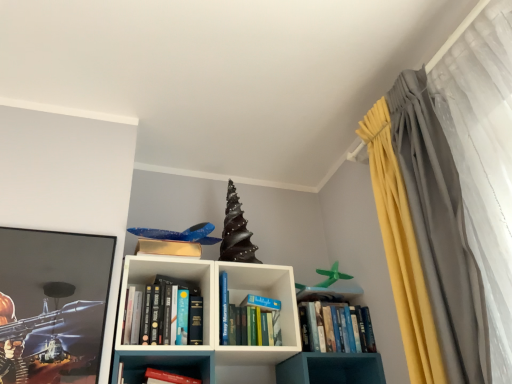
Question: Can you confirm if blue hardcover book at center, acting as the first book starting from the right, is bigger than hardcover book at center, which is counted as the second book, starting from the right?

Choices:
 (A) no
 (B) yes

Answer: (B)

Question: From the image's perspective, is blue hardcover book at center, acting as the first book starting from the right, under hardcover book at center, which appears as the second book when viewed from the left?

Choices:
 (A) no
 (B) yes

Answer: (A)

Question: Is blue hardcover book at center, placed as the 3th book when sorted from left to right, wider than hardcover book at center, which is counted as the second book, starting from the right?

Choices:
 (A) no
 (B) yes

Answer: (B)

Question: From the image's perspective, is blue hardcover book at center, placed as the 3th book when sorted from left to right, above hardcover book at center, which appears as the second book when viewed from the left?

Choices:
 (A) yes
 (B) no

Answer: (A)

Question: Is blue hardcover book at center, acting as the first book starting from the right, oriented away from hardcover book at center, which is counted as the second book, starting from the right?

Choices:
 (A) yes
 (B) no

Answer: (B)

Question: From a real-world perspective, is blue hardcover book at center, acting as the first book starting from the right, positioned under hardcover book at center, which is counted as the second book, starting from the right, based on gravity?

Choices:
 (A) yes
 (B) no

Answer: (B)

Question: Does blue hardcover book at center, acting as the first book starting from the right, have a smaller size compared to white matte bookshelf at center?

Choices:
 (A) no
 (B) yes

Answer: (B)

Question: Does blue hardcover book at center, acting as the first book starting from the right, have a lesser height compared to white matte bookshelf at center?

Choices:
 (A) no
 (B) yes

Answer: (B)

Question: From the image's perspective, is blue hardcover book at center, placed as the 3th book when sorted from left to right, located above white matte bookshelf at center?

Choices:
 (A) yes
 (B) no

Answer: (B)

Question: Would you say white matte bookshelf at center is part of blue hardcover book at center, placed as the 3th book when sorted from left to right,'s contents?

Choices:
 (A) yes
 (B) no

Answer: (B)

Question: Can you confirm if blue hardcover book at center, acting as the first book starting from the right, is taller than white matte bookshelf at center?

Choices:
 (A) no
 (B) yes

Answer: (A)

Question: Is blue hardcover book at center, placed as the 3th book when sorted from left to right, at the right side of white matte bookshelf at center?

Choices:
 (A) no
 (B) yes

Answer: (B)

Question: Could blue hardcover book at center, acting as the first book starting from the right, be considered to be inside hardcover books at center, which ranks as the third book in right-to-left order?

Choices:
 (A) yes
 (B) no

Answer: (B)